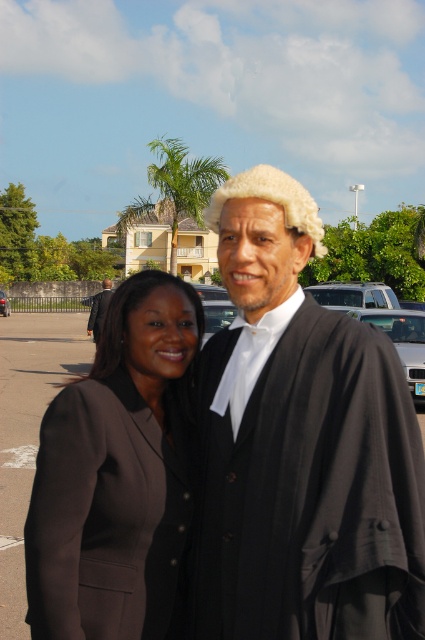
Question: From the image, what is the correct spatial relationship of black matte suit at center in relation to black wool suit at center?

Choices:
 (A) right
 (B) left

Answer: (A)

Question: Which of the following is the closest to the observer?

Choices:
 (A) black wool suit at center
 (B) black matte suit at center
 (C) matte black blazer at center
 (D) metallic silver car at center

Answer: (B)

Question: Which of the following is the closest to the observer?

Choices:
 (A) silver metallic suv at center
 (B) silver metallic car at center-right

Answer: (B)

Question: Does silver metallic suv at center have a larger size compared to black wool suit at center?

Choices:
 (A) yes
 (B) no

Answer: (A)

Question: Does silver metallic car at center-right have a lesser width compared to silver metallic suv at center?

Choices:
 (A) yes
 (B) no

Answer: (A)

Question: Which of the following is the farthest from the observer?

Choices:
 (A) metallic silver car at center
 (B) matte black blazer at center

Answer: (A)